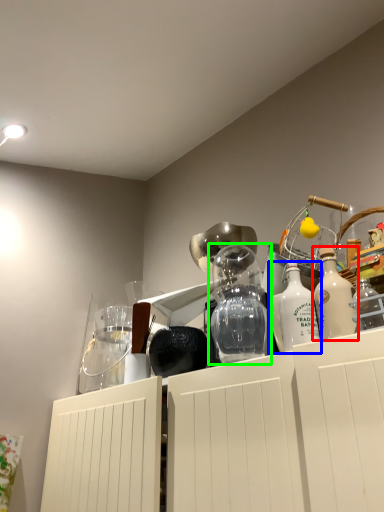
Question: Estimate the real-world distances between objects in this image. Which object is farther from bottle (highlighted by a red box), bottle (highlighted by a blue box) or glass vase (highlighted by a green box)?

Choices:
 (A) bottle
 (B) glass vase

Answer: (B)